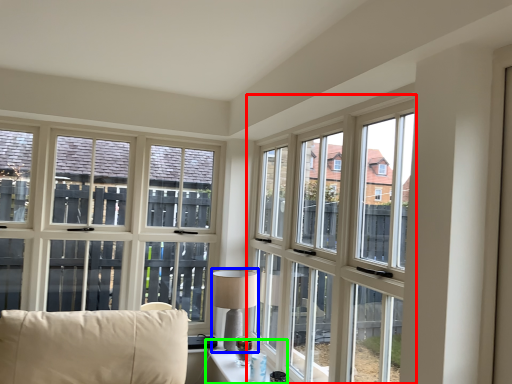
Question: Which object is positioned farthest from window (highlighted by a red box)? Select from table lamp (highlighted by a blue box) and table (highlighted by a green box).

Choices:
 (A) table lamp
 (B) table

Answer: (B)